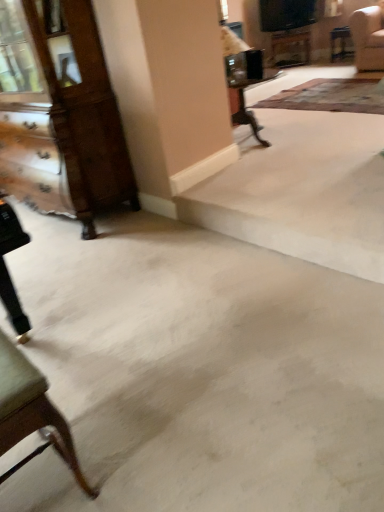
Question: Considering the positions of point (279, 50) and point (258, 106), is point (279, 50) closer or farther from the camera than point (258, 106)?

Choices:
 (A) farther
 (B) closer

Answer: (A)

Question: Looking at their shapes, would you say wooden table at upper center is wider or thinner than patterned carpet at upper right?

Choices:
 (A) wide
 (B) thin

Answer: (B)

Question: Estimate the real-world distances between objects in this image. Which object is farther from the wooden table at upper center?

Choices:
 (A) wooden dresser at left
 (B) patterned carpet at upper right

Answer: (A)

Question: Which of these objects is positioned farthest from the wooden table at upper center?

Choices:
 (A) wooden dresser at left
 (B) patterned carpet at upper right

Answer: (A)